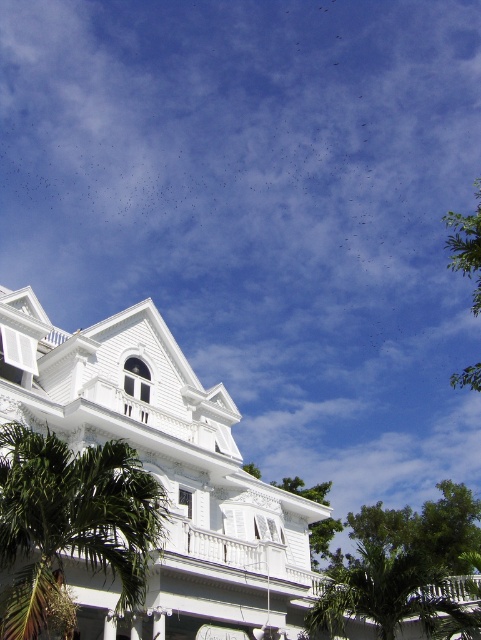
Question: Does green leafy palm tree at lower left have a greater width compared to green leafy palm tree at lower right?

Choices:
 (A) no
 (B) yes

Answer: (A)

Question: Which object appears farthest from the camera in this image?

Choices:
 (A) green leafy palm tree at lower right
 (B) green leafy palm tree at lower left

Answer: (A)

Question: Does green leafy palm tree at lower left have a smaller size compared to green leafy palm tree at lower right?

Choices:
 (A) no
 (B) yes

Answer: (B)

Question: Does green leafy palm tree at lower left appear under green leafy palm tree at lower right?

Choices:
 (A) no
 (B) yes

Answer: (A)

Question: Which of the following is the farthest from the observer?

Choices:
 (A) (370, 589)
 (B) (11, 589)

Answer: (A)